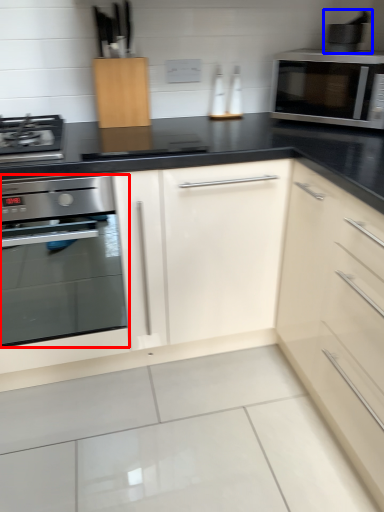
Question: Which object appears farthest to the camera in this image, oven (highlighted by a red box) or appliance (highlighted by a blue box)?

Choices:
 (A) oven
 (B) appliance

Answer: (B)